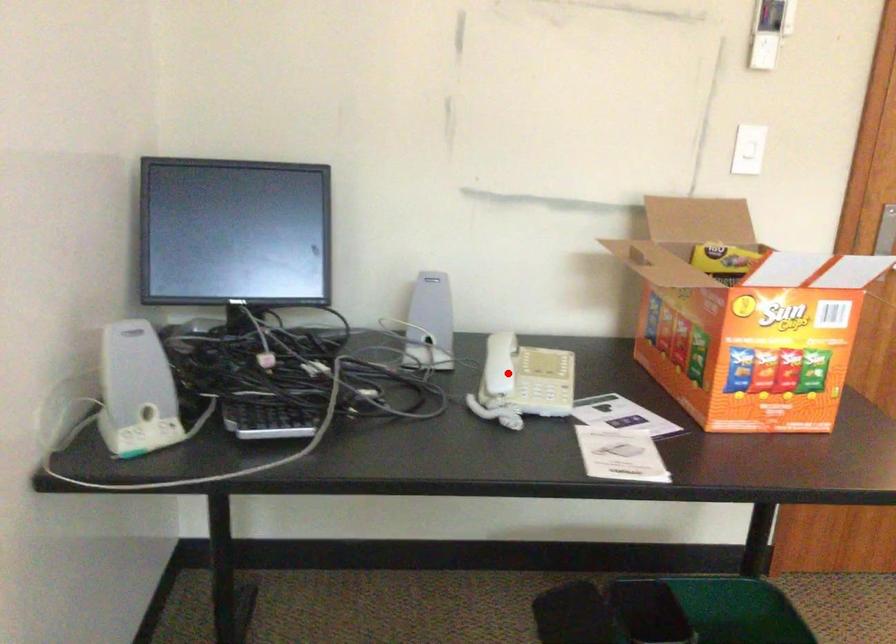
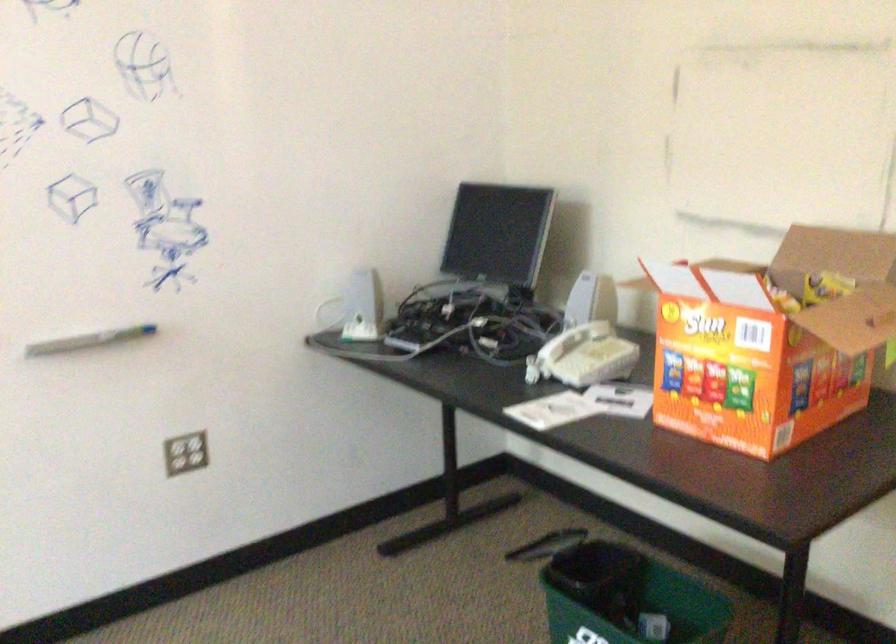
Question: I am providing you with two images of the same scene from different viewpoints. In image1, a red point is highlighted. Considering the same 3D point in image2, which of the following is correct?

Choices:
 (A) It is closer
 (B) It is farther

Answer: (B)